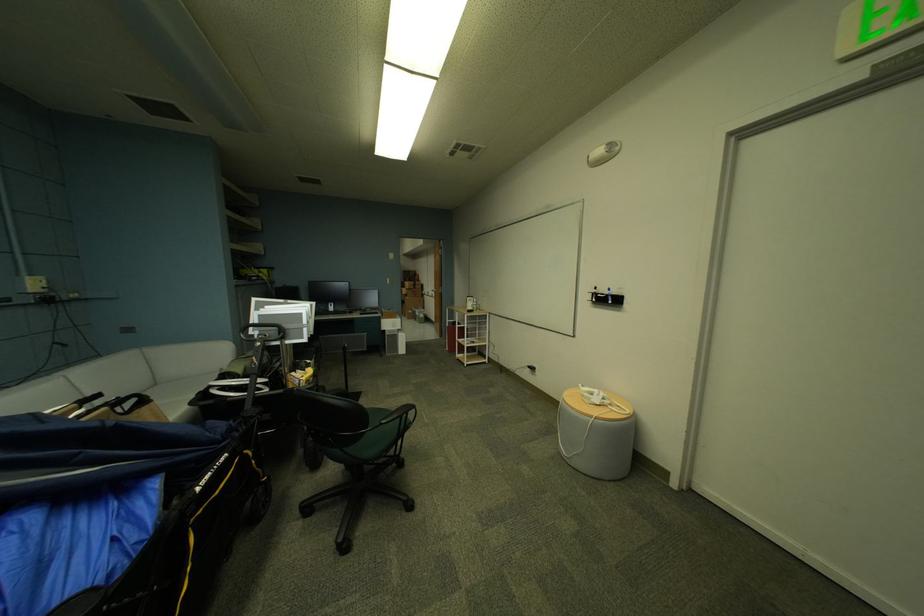
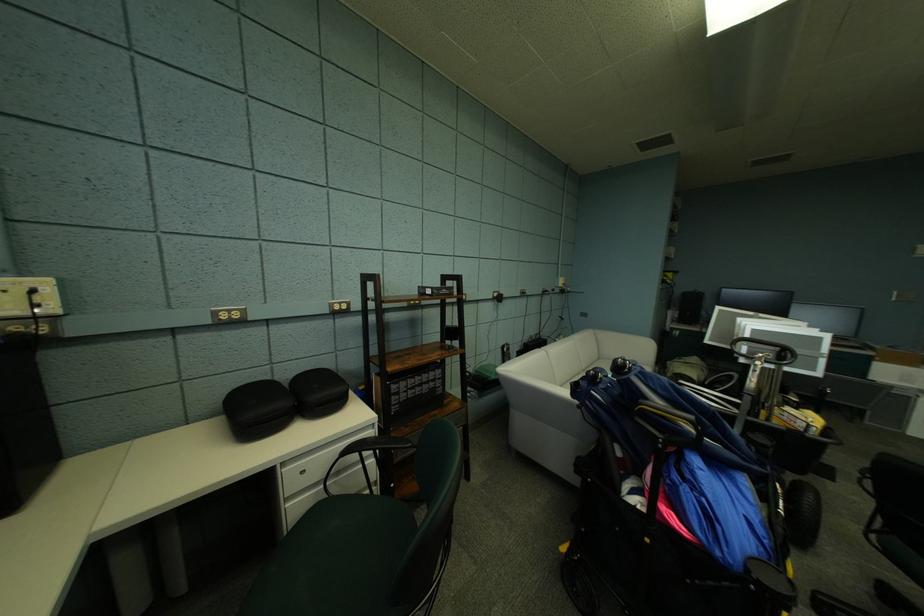
Question: The camera is either moving clockwise (left) or counter-clockwise (right) around the object. The first image is from the beginning of the video and the second image is from the end. Is the camera moving left or right when shooting the video?

Choices:
 (A) Left
 (B) Right

Answer: (B)